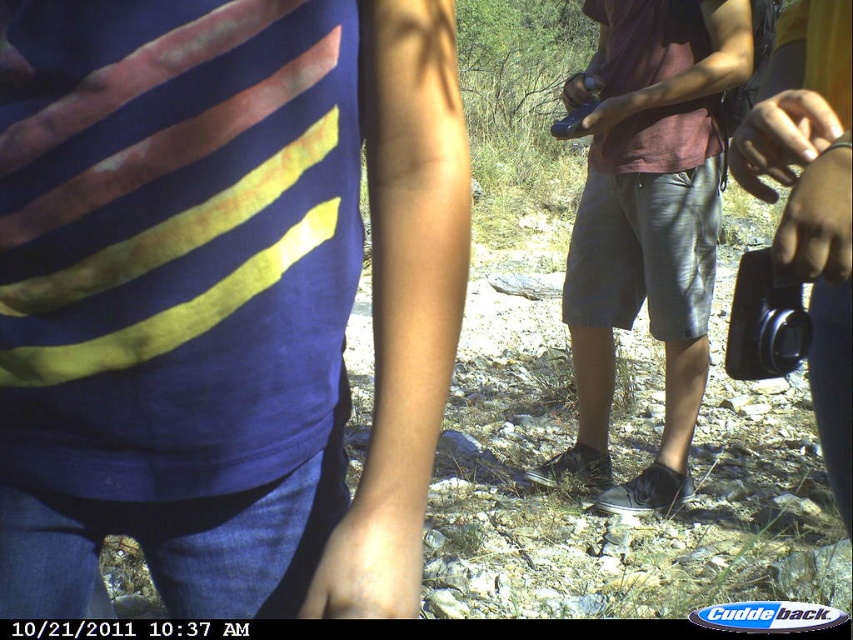
Question: Is dark gray denim shorts at center bigger than black plastic camera at right?

Choices:
 (A) no
 (B) yes

Answer: (B)

Question: Which of these objects is positioned closest to the blue matte shirt at center?

Choices:
 (A) dark gray denim shorts at center
 (B) black plastic camera at right

Answer: (B)

Question: Can you confirm if blue matte shirt at center is positioned to the right of dark gray denim shorts at center?

Choices:
 (A) yes
 (B) no

Answer: (B)

Question: Which point appears closest to the camera in this image?

Choices:
 (A) (599, 356)
 (B) (775, 296)

Answer: (B)

Question: Is dark gray denim shorts at center to the right of black plastic camera at right from the viewer's perspective?

Choices:
 (A) no
 (B) yes

Answer: (B)

Question: Which of the following is the closest to the observer?

Choices:
 (A) blue matte shirt at center
 (B) black plastic camera at right

Answer: (A)